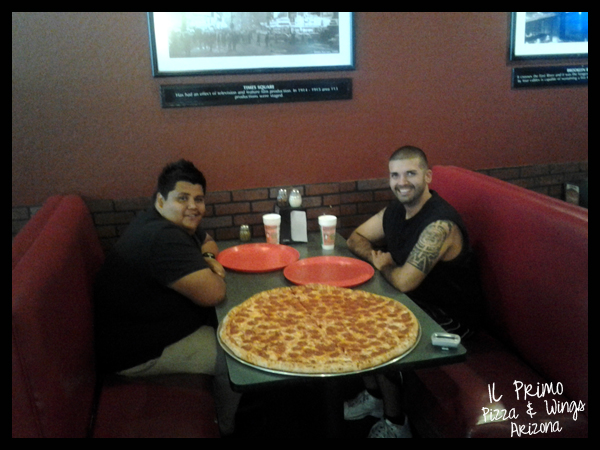
Where is `brick wall`? brick wall is located at coordinates (241, 209).